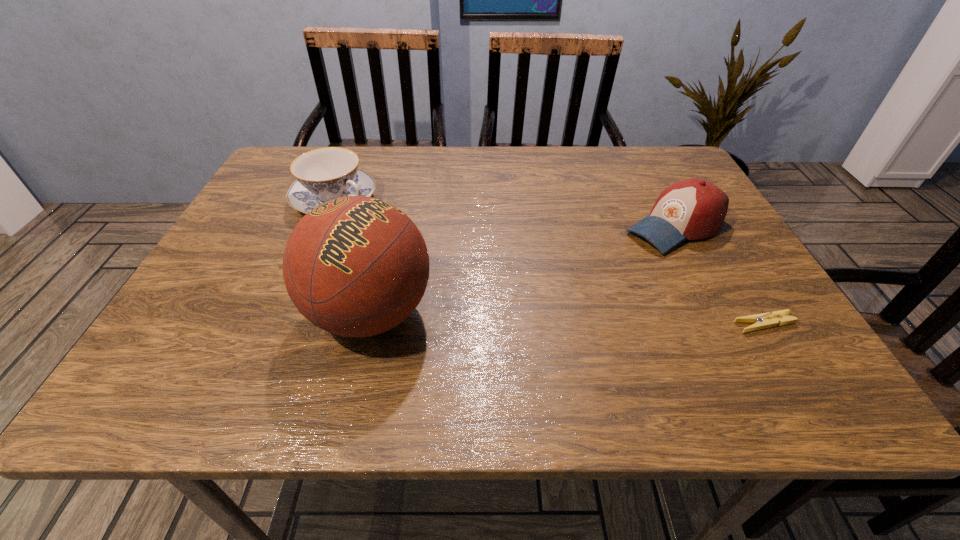
Locate an element on the screen. free region located with the handle on the side of the chinaware is located at coordinates 485,272.

Identify the location of vacant space located with the handle on the side of the chinaware. Image resolution: width=960 pixels, height=540 pixels. (463, 261).

The image size is (960, 540). In order to click on object that is at the far edge in this screenshot , I will do `click(324, 174)`.

At what (x,y) coordinates should I click in order to perform the action: click on basketball that is at the near edge. Please return your answer as a coordinate pair (x, y). Looking at the image, I should click on (356, 266).

Image resolution: width=960 pixels, height=540 pixels. Find the location of `clothespin that is at the near edge`. clothespin that is at the near edge is located at coordinates (765, 320).

Locate an element on the screen. This screenshot has height=540, width=960. object that is at the left edge is located at coordinates (324, 174).

Identify the location of clothespin located at the right edge. [765, 320].

I want to click on baseball cap located in the right edge section of the desktop, so click(x=691, y=209).

Locate an element on the screen. The height and width of the screenshot is (540, 960). object present at the far left corner is located at coordinates (324, 174).

Locate an element on the screen. This screenshot has width=960, height=540. object that is at the near right corner is located at coordinates (765, 320).